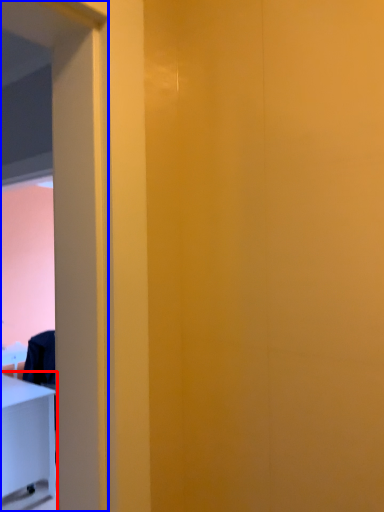
Question: Which of the following is the farthest to the observer, furniture (highlighted by a red box) or screen door (highlighted by a blue box)?

Choices:
 (A) furniture
 (B) screen door

Answer: (A)